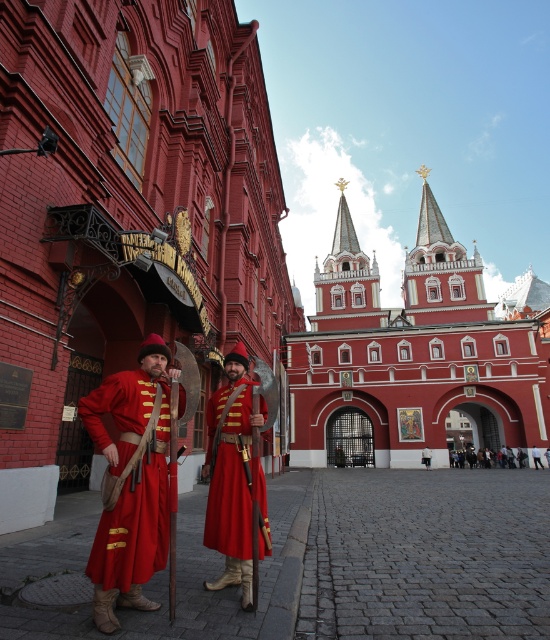
You are an architect analyzing the proportions of the scene. Which object, the matte red building at center or the matte red robe at center, has a greater width?

The matte red building at center has a greater width than the matte red robe at center, as stated in the description.

Consider the image. You are an artist trying to sketch this scene. You want to ensure the matte red building at center and the matte red robe at center are placed correctly. Based on their positions, which one should you draw first to maintain the proper spatial relationship?

The matte red building at center should be drawn first because it is positioned over the matte red robe at center, meaning the building is in front and the robe is behind.

You are a visitor trying to enter the historic building through the smooth red stone gate at center. You are wearing the red velvet coat at center. Will the height of the gate allow you to pass through without bending down?

The smooth red stone gate at center has a greater height compared to the red velvet coat at center, so you can pass through without bending down.